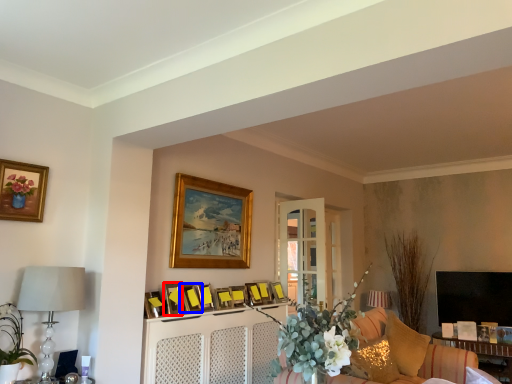
Question: Among these objects, which one is nearest to the camera, picture frame (highlighted by a red box) or picture frame (highlighted by a blue box)?

Choices:
 (A) picture frame
 (B) picture frame

Answer: (A)